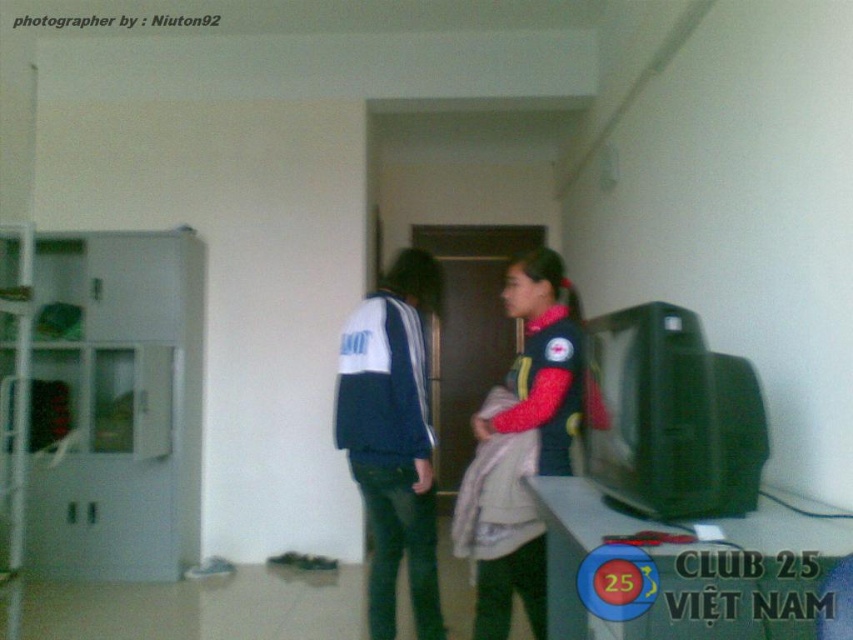
Question: Which of the following is the closest to the observer?

Choices:
 (A) (459, 532)
 (B) (402, 269)

Answer: (A)

Question: Is blue fleece jacket at center below velvet-like red jacket at center?

Choices:
 (A) no
 (B) yes

Answer: (B)

Question: Is blue fleece jacket at center in front of velvet-like red jacket at center?

Choices:
 (A) yes
 (B) no

Answer: (B)

Question: Which of the following is the farthest from the observer?

Choices:
 (A) velvet-like red jacket at center
 (B) blue fleece jacket at center

Answer: (B)

Question: In this image, where is blue fleece jacket at center located relative to velvet-like red jacket at center?

Choices:
 (A) right
 (B) left

Answer: (B)